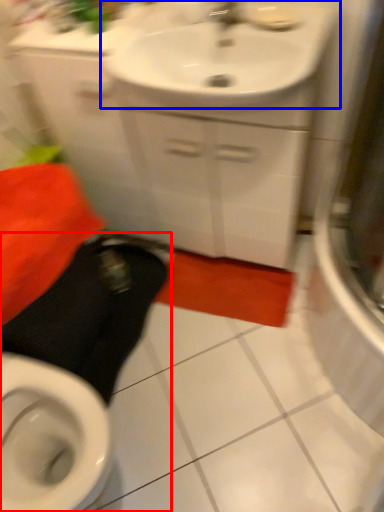
Question: Which of the following is the farthest to the observer, squat (highlighted by a red box) or sink (highlighted by a blue box)?

Choices:
 (A) squat
 (B) sink

Answer: (B)